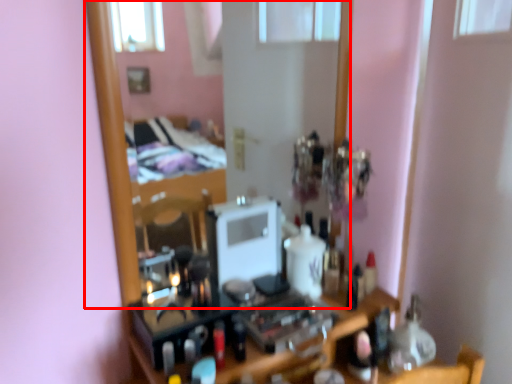
Question: Where is mirror (annotated by the red box) located in relation to toiletry in the image?

Choices:
 (A) right
 (B) left

Answer: (B)